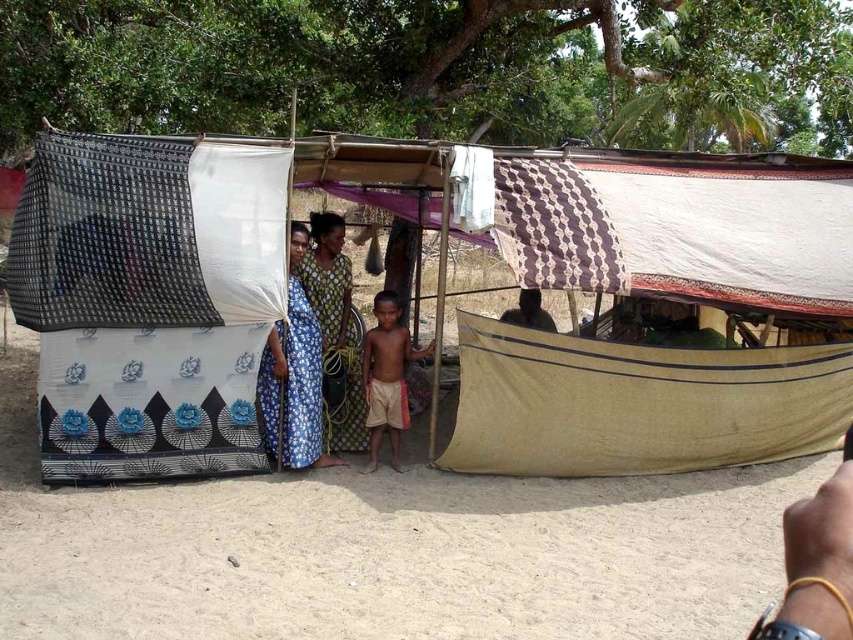
You are a photographer setting up a shot of the beige sandy ground at lower center and the tan cotton shorts at center. Which object should you focus on first if you want to capture the wider subject?

The beige sandy ground at lower center should be focused on first because its width is larger than the tan cotton shorts at center.